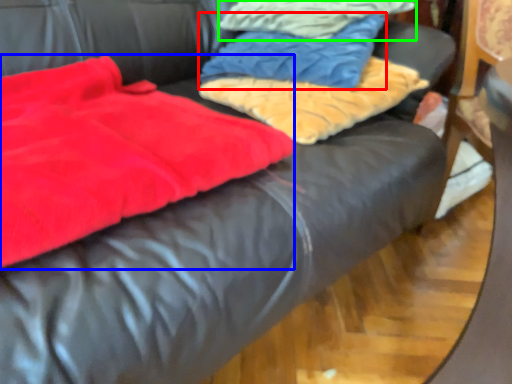
Question: Which is farther away from cloth (highlighted by a red box)? blanket (highlighted by a blue box) or cloth (highlighted by a green box)?

Choices:
 (A) blanket
 (B) cloth

Answer: (A)